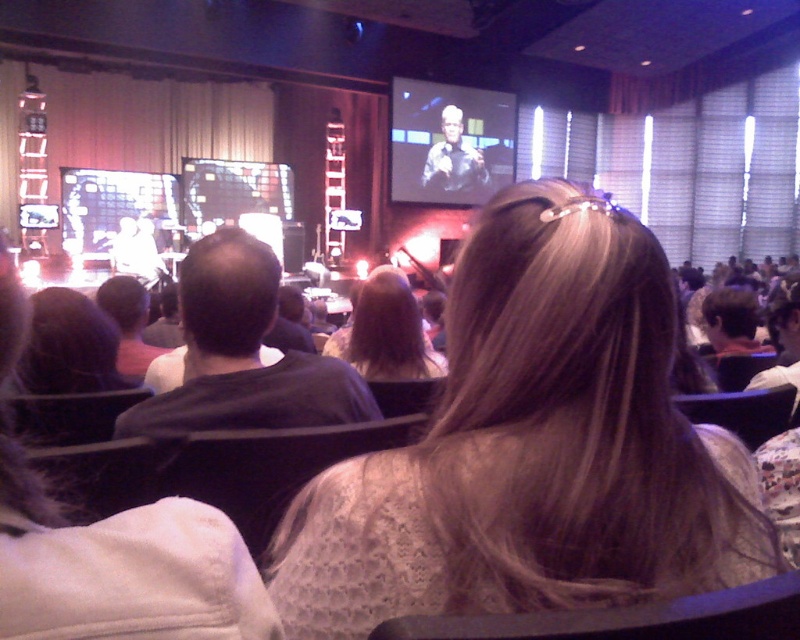
You are sitting in the front row of the auditorium and notice two points on the stage. The first point is at coordinates point [410,461] and the second is at point [296,396]. Which point would appear larger to you from your seat?

Point [410,461] would appear larger because it is closer to the camera than point [296,396], making it visually larger from your perspective.

You are an event coordinator planning to place a decorative banner between the white lace dress at center and the black cotton shirt at left. Based on their widths, which side of the banner should be closer to the wider item to ensure balance?

The white lace dress at center is wider than the black cotton shirt at left. To ensure balance, the decorative banner should be placed closer to the wider item, the white lace dress at center, so that the narrower black cotton shirt at left is offset by the banner on the opposite side.